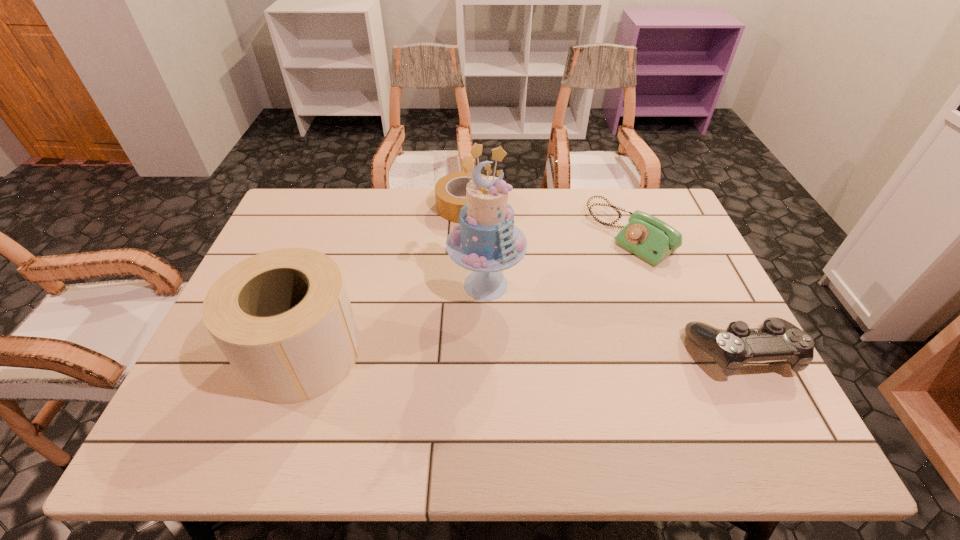
I want to click on control present at the near edge, so click(x=777, y=339).

This screenshot has height=540, width=960. Identify the location of object at the left edge. (283, 319).

Locate an element on the screen. control that is positioned at the right edge is located at coordinates (777, 339).

Image resolution: width=960 pixels, height=540 pixels. Identify the location of telephone that is at the right edge. (648, 237).

Where is `object that is at the near left corner`? The width and height of the screenshot is (960, 540). object that is at the near left corner is located at coordinates (283, 319).

This screenshot has width=960, height=540. I want to click on object at the far right corner, so 648,237.

In order to click on object present at the near right corner in this screenshot , I will do `click(777, 339)`.

The height and width of the screenshot is (540, 960). In the image, there is a desktop. In order to click on blank space at the far edge in this screenshot , I will do `click(424, 194)`.

You are a GUI agent. You are given a task and a screenshot of the screen. Output one action in this format:
    pyautogui.click(x=<x>, y=<y>)
    Task: Click on the vacant region at the near edge of the desktop
    This screenshot has height=540, width=960.
    Given the screenshot: What is the action you would take?
    pyautogui.click(x=576, y=377)

This screenshot has height=540, width=960. I want to click on vacant region at the left edge of the desktop, so click(x=205, y=372).